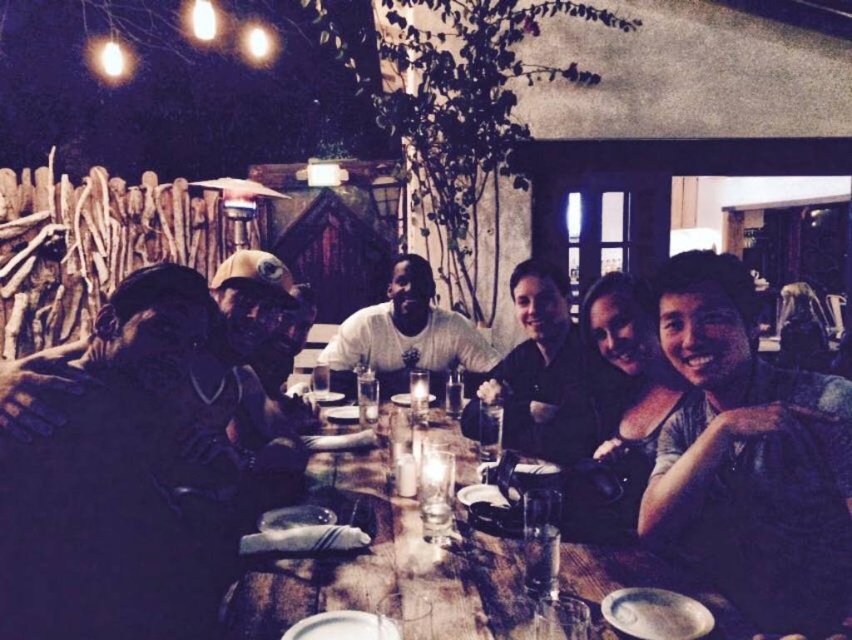
Where is `wooden table at center`? The height and width of the screenshot is (640, 852). wooden table at center is located at coordinates (384, 566).

How distant is wooden table at center from white matte shirt at center?

A distance of 1.54 meters exists between wooden table at center and white matte shirt at center.

Who is more distant from viewer, (486, 579) or (435, 358)?

The point (435, 358) is behind.

Identify the location of wooden table at center. This screenshot has height=640, width=852. (384, 566).

From the picture: Is dark matte jacket at left wider than black matte shirt at center?

In fact, dark matte jacket at left might be narrower than black matte shirt at center.

Does point (1, 560) come farther from viewer compared to point (524, 410)?

That is False.

Where is `dark matte jacket at left`? The image size is (852, 640). dark matte jacket at left is located at coordinates (111, 483).

Who is taller, dark matte jacket at left or blue denim shirt at lower right?

With more height is dark matte jacket at left.

Which is more to the left, dark matte jacket at left or blue denim shirt at lower right?

From the viewer's perspective, dark matte jacket at left appears more on the left side.

This screenshot has height=640, width=852. Identify the location of dark matte jacket at left. (111, 483).